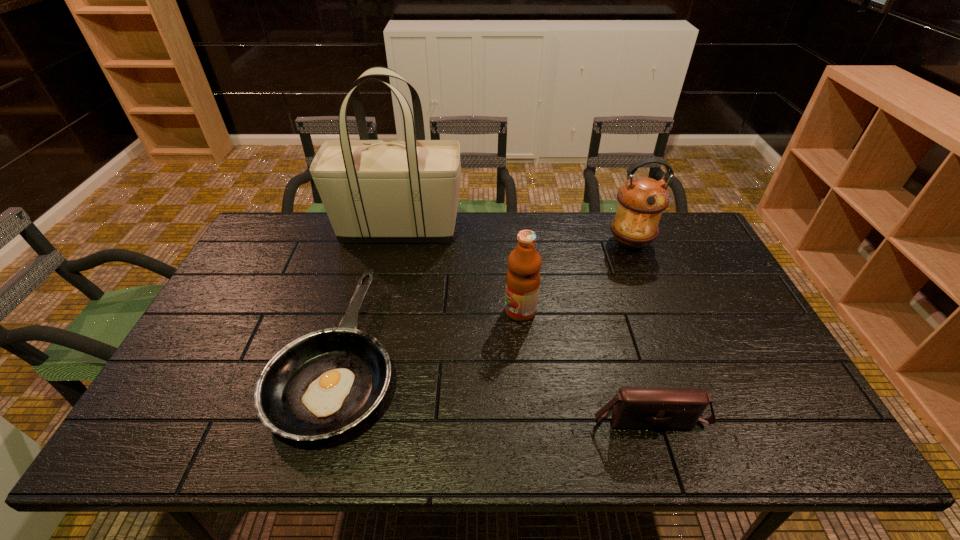
Select which object is the closest to the oil lamp. Please provide its 2D coordinates. Your answer should be formatted as a tuple, i.e. [(x, y)], where the tuple contains the x and y coordinates of a point satisfying the conditions above.

[(524, 263)]

The image size is (960, 540). Identify the location of free point that satisfies the following two spatial constraints: 1. on the back side of the oil lamp; 2. with handles facing forward on the shopping bag. (625, 230).